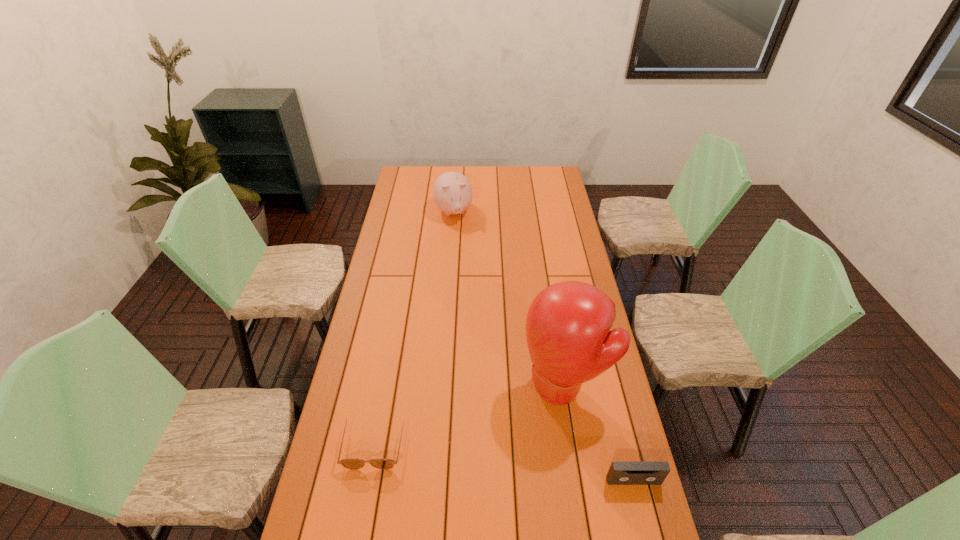
Locate an element on the screen. This screenshot has width=960, height=540. blank space at the far left corner is located at coordinates (401, 172).

In order to click on free space at the near left corner of the desktop in this screenshot , I will do `click(339, 529)`.

Find the location of a particular element. The image size is (960, 540). vacant space at the far right corner is located at coordinates (551, 177).

I want to click on free space that is in between the shortest object and the piggy bank, so click(414, 327).

In order to click on empty location between the tallest object and the sunglasses in this screenshot , I will do `click(469, 413)`.

At what (x,y) coordinates should I click in order to perform the action: click on vacant space in between the nearest object and the sunglasses. Please return your answer as a coordinate pair (x, y). The height and width of the screenshot is (540, 960). Looking at the image, I should click on (504, 461).

Identify the location of vacant space that is in between the boxing glove and the second tallest object. This screenshot has height=540, width=960. (509, 299).

Find the location of a particular element. vacant area that lies between the videotape and the shortest object is located at coordinates (504, 461).

Find the location of `unoccupied area between the tallest object and the nearest object`. unoccupied area between the tallest object and the nearest object is located at coordinates (599, 433).

At what (x,y) coordinates should I click in order to perform the action: click on free space between the nearest object and the tallest object. Please return your answer as a coordinate pair (x, y). This screenshot has width=960, height=540. Looking at the image, I should click on (599, 433).